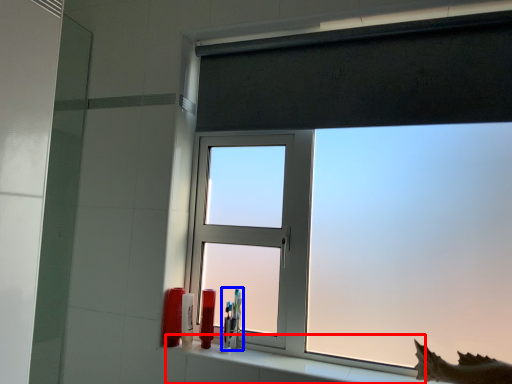
Question: Among these objects, which one is farthest to the camera, window sill (highlighted by a red box) or toiletry (highlighted by a blue box)?

Choices:
 (A) window sill
 (B) toiletry

Answer: (B)